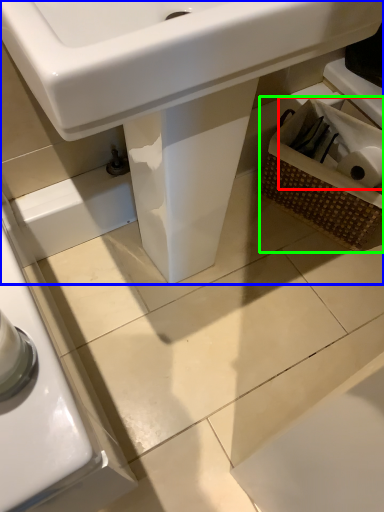
Question: Estimate the real-world distances between objects in this image. Which object is farther from toilet paper (highlighted by a red box), sink (highlighted by a blue box) or basket (highlighted by a green box)?

Choices:
 (A) sink
 (B) basket

Answer: (A)